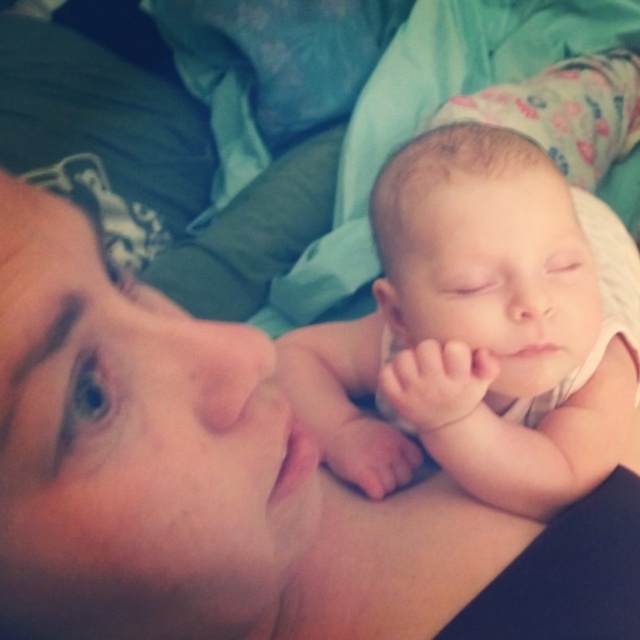
You are a photographer observing the scene. You notice two infants, the smooth skin baby at center and the smooth skin newborn at center. Which one is located to the left?

The smooth skin baby at center is positioned on the left side of the smooth skin newborn at center, so the smooth skin baby at center is the one located to the left.

You are a photographer capturing a closeup of two infants in a soft, warm setting. You notice the smooth skin baby at center and the smooth skin newborn at center. Which one appears nearer to you?

The smooth skin baby at center is closer to the viewer than the smooth skin newborn at center.